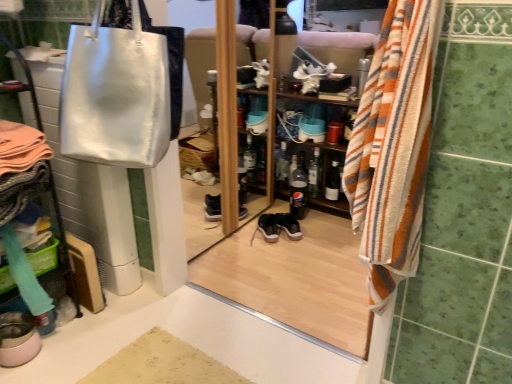
What do you see at coordinates (18, 339) in the screenshot? I see `metallic silver bowl at lower left, marked as the first footwear in a front-to-back arrangement` at bounding box center [18, 339].

Based on the photo, what is the approximate width of metallic silver bowl at lower left, the first footwear ordered from the bottom?

7.51 inches.

The image size is (512, 384). In order to click on matte silver bag at upper left in this screenshot , I will do `click(296, 276)`.

What are the coordinates of `metallic silver bowl at lower left, marked as the first footwear in a front-to-back arrangement` in the screenshot? It's located at (18, 339).

I want to click on the 2nd footwear located beneath the matte silver bag at upper left (from a real-world perspective), so click(x=18, y=339).

Is metallic silver bowl at lower left, positioned as the second footwear in right-to-left order, taller or shorter than matte silver bag at upper left?

Considering their sizes, metallic silver bowl at lower left, positioned as the second footwear in right-to-left order, has less height than matte silver bag at upper left.

Which point is more forward, [26,326] or [306,33]?

The point [26,326] is more forward.

The image size is (512, 384). I want to click on shoe lying below the translucent plastic bottle at center, the 2th bottle when ordered from left to right (from the image's perspective), so click(269, 227).

In the scene shown: From the image's perspective, would you say translucent plastic bottle at center, the 3th bottle from the right, is positioned over black suede shoe at center?

Indeed, from the image's perspective, translucent plastic bottle at center, the 3th bottle from the right, is shown above black suede shoe at center.

Does translucent plastic bottle at center, the 2th bottle when ordered from left to right, have a lesser height compared to black suede shoe at center?

No, translucent plastic bottle at center, the 2th bottle when ordered from left to right, is not shorter than black suede shoe at center.

Can you confirm if translucent plastic bottle at center, the 2th bottle when ordered from left to right, is shorter than black glass bottle at center, the first bottle viewed from the right?

No, translucent plastic bottle at center, the 2th bottle when ordered from left to right, is not shorter than black glass bottle at center, the first bottle viewed from the right.

In the image, is translucent plastic bottle at center, the 2th bottle when ordered from left to right, positioned in front of or behind black glass bottle at center, the fourth bottle when ordered from left to right?

In the image, translucent plastic bottle at center, the 2th bottle when ordered from left to right, appears in front of black glass bottle at center, the fourth bottle when ordered from left to right.

Can you confirm if translucent plastic bottle at center, the 2th bottle when ordered from left to right, is positioned to the left of black glass bottle at center, the first bottle viewed from the right?

Correct, you'll find translucent plastic bottle at center, the 2th bottle when ordered from left to right, to the left of black glass bottle at center, the first bottle viewed from the right.

From the image's perspective, is translucent plastic bottle at center, the 3th bottle from the right, on black glass bottle at center, the fourth bottle when ordered from left to right?

No, from the image's perspective, translucent plastic bottle at center, the 3th bottle from the right, is not above black glass bottle at center, the fourth bottle when ordered from left to right.

Does matte black sneakers at center, the second footwear ordered from the bottom, have a larger size compared to matte silver bag at upper left?

Incorrect, matte black sneakers at center, the second footwear ordered from the bottom, is not larger than matte silver bag at upper left.

From a real-world perspective, is matte black sneakers at center, the 2th footwear from the front, positioned under matte silver bag at upper left based on gravity?

Yes.

Which is further, (287, 225) or (308, 246)?

The point (287, 225) is farther.

Which object is closer to the camera, matte black sneakers at center, the 2th footwear in the left-to-right sequence, or matte silver bag at upper left?

matte silver bag at upper left is in front.

From a real-world perspective, which bottle is the 1st one above the black glass bottle at center, the fourth bottle when ordered from left to right? Please provide its 2D coordinates.

[(315, 174)]

Can you confirm if black glass bottle at center, the fourth bottle when ordered from left to right, is shorter than clear glass bottle at center, which is the 2th bottle in right-to-left order?

Indeed, black glass bottle at center, the fourth bottle when ordered from left to right, has a lesser height compared to clear glass bottle at center, which is the 2th bottle in right-to-left order.

Relative to clear glass bottle at center, which is the 2th bottle in right-to-left order, is black glass bottle at center, the fourth bottle when ordered from left to right, in front or behind?

In the image, black glass bottle at center, the fourth bottle when ordered from left to right, appears in front of clear glass bottle at center, which is the 2th bottle in right-to-left order.

From the picture: Is black glass bottle at center, the first bottle viewed from the right, facing away from clear glass bottle at center, the third bottle viewed from the left?

black glass bottle at center, the first bottle viewed from the right, does not have its back to clear glass bottle at center, the third bottle viewed from the left.

From the image's perspective, which is above, striped cotton towel at right or clear glass bottle at center, the third bottle viewed from the left?

clear glass bottle at center, the third bottle viewed from the left, from the image's perspective.

In the scene shown: How different are the orientations of striped cotton towel at right and clear glass bottle at center, the third bottle viewed from the left, in degrees?

striped cotton towel at right and clear glass bottle at center, the third bottle viewed from the left, are facing 5.52 degrees away from each other.

Between point (398, 154) and point (309, 184), which one is positioned behind?

The point (309, 184) is farther from the camera.

Is striped cotton towel at right to the right of clear glass bottle at center, the third bottle viewed from the left, from the viewer's perspective?

No, striped cotton towel at right is not to the right of clear glass bottle at center, the third bottle viewed from the left.

Is the depth of beige textured bath mat at lower center less than that of matte silver bag at upper left?

No, it is not.

Is beige textured bath mat at lower center oriented away from matte silver bag at upper left?

Yes, beige textured bath mat at lower center is facing away from matte silver bag at upper left.

Considering the positions of objects beige textured bath mat at lower center and matte silver bag at upper left in the image provided, who is more to the right, beige textured bath mat at lower center or matte silver bag at upper left?

matte silver bag at upper left.

The width and height of the screenshot is (512, 384). In order to click on screen door on the right of beige textured bath mat at lower center in this screenshot , I will do `click(296, 276)`.

From a real-world perspective, starting from the matte silver bag at upper left, which footwear is the 2nd one below it? Please provide its 2D coordinates.

[(18, 339)]

At what (x,y) coordinates should I click in order to perform the action: click on shoe located on the left of translucent plastic bottle at center, the 3th bottle from the right. Please return your answer as a coordinate pair (x, y). Looking at the image, I should click on (269, 227).

From the image, which object appears to be nearer to clear glass bottle at center, placed as the fourth bottle when sorted from right to left, wooden shelf at center or striped cotton towel at right?

wooden shelf at center.

Which object lies nearer to the anchor point metallic silver bowl at lower left, acting as the 2th footwear starting from the back, translucent plastic bottle at center, the 2th bottle when ordered from left to right, or striped cotton towel at right?

striped cotton towel at right lies closer to metallic silver bowl at lower left, acting as the 2th footwear starting from the back, than the other object.

Considering their positions, is matte black sneakers at center, the second footwear ordered from the bottom, positioned closer to black suede shoe at center than metallic silver bowl at lower left, placed as the 2th footwear when sorted from top to bottom?

matte black sneakers at center, the second footwear ordered from the bottom, lies closer to black suede shoe at center than the other object.

Based on their spatial positions, is beige textured bath mat at lower center or striped cotton towel at right further from shiny silver bag at upper left?

beige textured bath mat at lower center lies further to shiny silver bag at upper left than the other object.

When comparing their distances from striped cotton towel at right, does wooden shelf at center or black suede shoe at center seem further?

wooden shelf at center lies further to striped cotton towel at right than the other object.

Based on their spatial positions, is striped cotton towel at right or matte black sneakers at center, acting as the 1th footwear starting from the back, closer to black glass bottle at center, the first bottle viewed from the right?

The object closer to black glass bottle at center, the first bottle viewed from the right, is matte black sneakers at center, acting as the 1th footwear starting from the back.

Estimate the real-world distances between objects in this image. Which object is closer to wooden shelf at center, matte silver bag at upper left or clear glass bottle at center, which is the 2th bottle in right-to-left order?

clear glass bottle at center, which is the 2th bottle in right-to-left order, lies closer to wooden shelf at center than the other object.

Based on their spatial positions, is black glass bottle at center, the fourth bottle when ordered from left to right, or wooden shelf at center closer to translucent plastic bottle at center, the 2th bottle when ordered from left to right?

black glass bottle at center, the fourth bottle when ordered from left to right, is closer to translucent plastic bottle at center, the 2th bottle when ordered from left to right.

I want to click on bottle situated between translucent plastic bottle at center, the 3th bottle from the right, and black glass bottle at center, the fourth bottle when ordered from left to right, from left to right, so pos(315,174).

Find the location of `shoe between beige textured bath mat at lower center and clear glass bottle at center, the third bottle viewed from the left, from front to back`. shoe between beige textured bath mat at lower center and clear glass bottle at center, the third bottle viewed from the left, from front to back is located at coordinates (269, 227).

This screenshot has width=512, height=384. Identify the location of shoe between beige textured bath mat at lower center and matte black sneakers at center, the 2th footwear from the front, in the front-back direction. (269, 227).

Locate an element on the screen. This screenshot has width=512, height=384. shelf positioned between beige textured bath mat at lower center and matte black sneakers at center, acting as the 1th footwear starting from the back, from near to far is located at coordinates (326, 175).